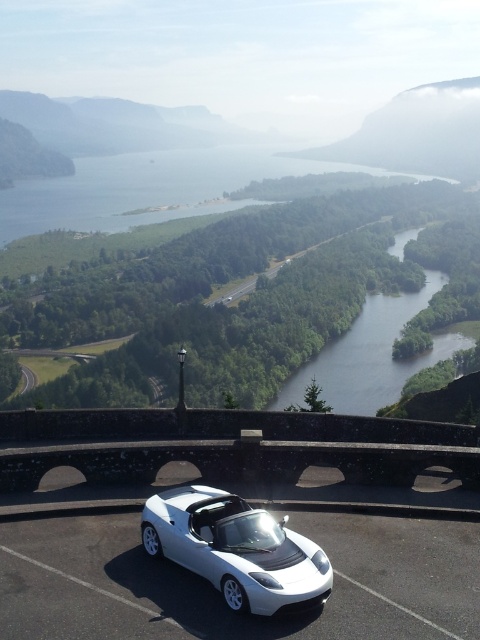
Question: Is white glossy car at center smaller than green smooth water at center?

Choices:
 (A) no
 (B) yes

Answer: (B)

Question: Which of these objects is positioned farthest from the green smooth water at center?

Choices:
 (A) blue water at center
 (B) white glossy car at center

Answer: (A)

Question: Which point is farther to the camera?

Choices:
 (A) (312, 362)
 (B) (310, 170)
 (C) (191, 492)

Answer: (B)

Question: Can you confirm if blue water at center is smaller than green smooth water at center?

Choices:
 (A) yes
 (B) no

Answer: (B)

Question: Which is farther from the green smooth water at center?

Choices:
 (A) blue water at center
 (B) white glossy car at center

Answer: (A)

Question: Does blue water at center lie in front of green smooth water at center?

Choices:
 (A) no
 (B) yes

Answer: (A)